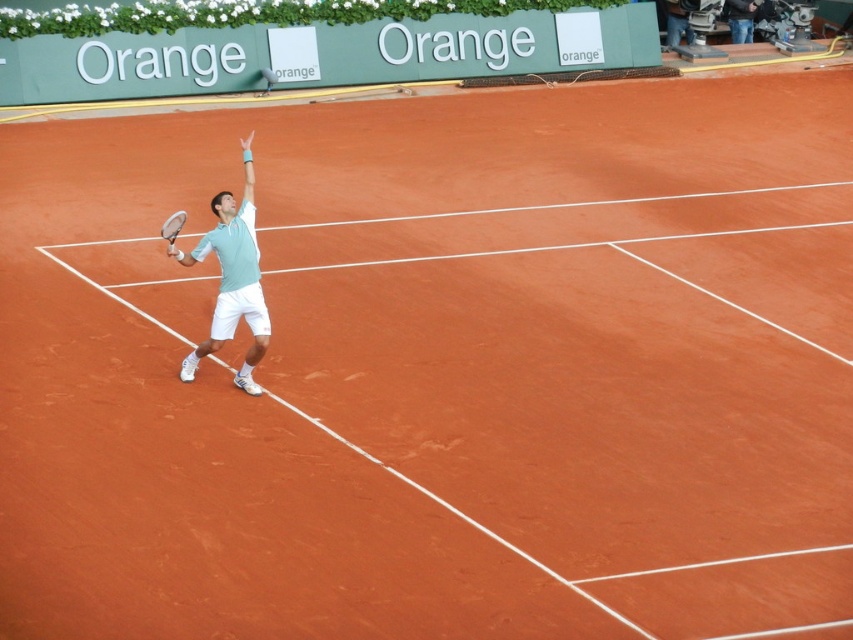
Question: Which point appears farthest from the camera in this image?

Choices:
 (A) click(165, 221)
 (B) click(251, 170)

Answer: (B)

Question: Can you confirm if light blue fabric shirt at center is positioned above white matte tennis racket at center-left?

Choices:
 (A) yes
 (B) no

Answer: (B)

Question: Which object appears farthest from the camera in this image?

Choices:
 (A) white matte tennis racket at center-left
 (B) light blue fabric shirt at center

Answer: (A)

Question: Is light blue fabric shirt at center below white matte tennis racket at center-left?

Choices:
 (A) yes
 (B) no

Answer: (A)

Question: Can you confirm if light blue fabric shirt at center is positioned below white matte tennis racket at center-left?

Choices:
 (A) yes
 (B) no

Answer: (A)